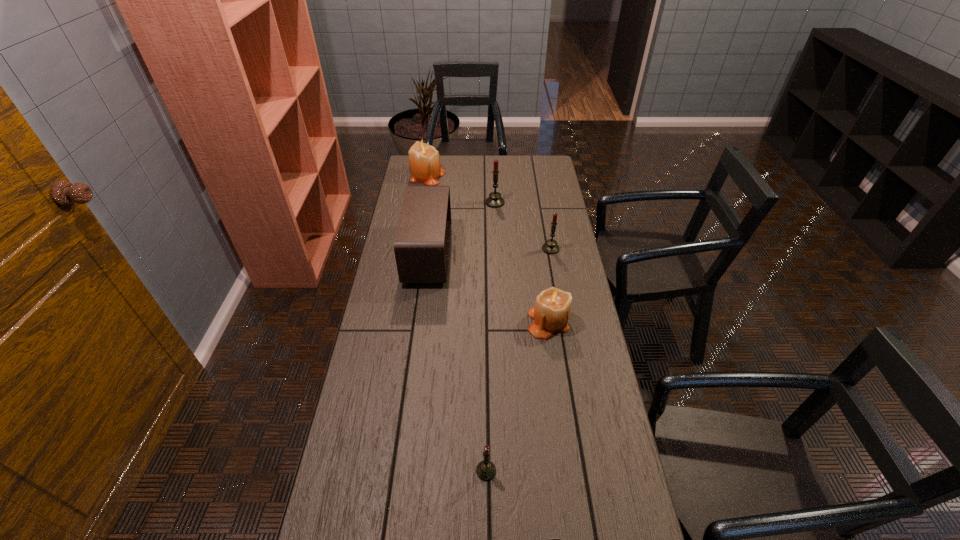
In order to click on object situated at the far left corner in this screenshot , I will do `click(424, 161)`.

In the image, there is a desktop. In order to click on vacant region at the left edge in this screenshot , I will do `click(411, 285)`.

This screenshot has height=540, width=960. In the image, there is a desktop. In order to click on vacant space at the right edge in this screenshot , I will do `click(558, 208)`.

Image resolution: width=960 pixels, height=540 pixels. I want to click on free space at the far right corner of the desktop, so click(529, 168).

Locate an element on the screen. vacant area that lies between the rightmost red candle and the third nearest object is located at coordinates (549, 285).

The image size is (960, 540). I want to click on free spot between the brown radio receiver and the smallest red candle, so click(457, 363).

Locate an element on the screen. free space between the radio receiver and the second nearest candle is located at coordinates (488, 288).

Image resolution: width=960 pixels, height=540 pixels. Identify the location of free area in between the third nearest candle and the farthest object. (489, 212).

This screenshot has width=960, height=540. I want to click on free space between the fifth farthest object and the nearest candle, so click(517, 396).

Where is `empty location between the brown radio receiver and the second nearest red candle`? empty location between the brown radio receiver and the second nearest red candle is located at coordinates (490, 252).